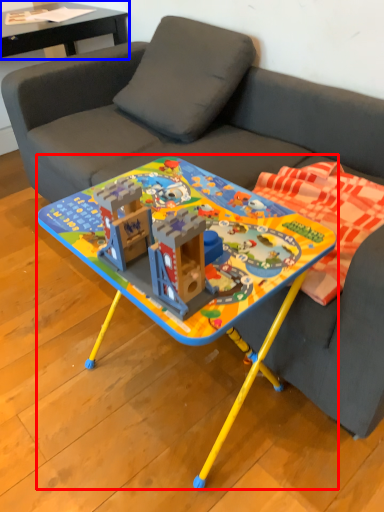
Question: Which point is closer to the camera, table (highlighted by a red box) or table (highlighted by a blue box)?

Choices:
 (A) table
 (B) table

Answer: (A)